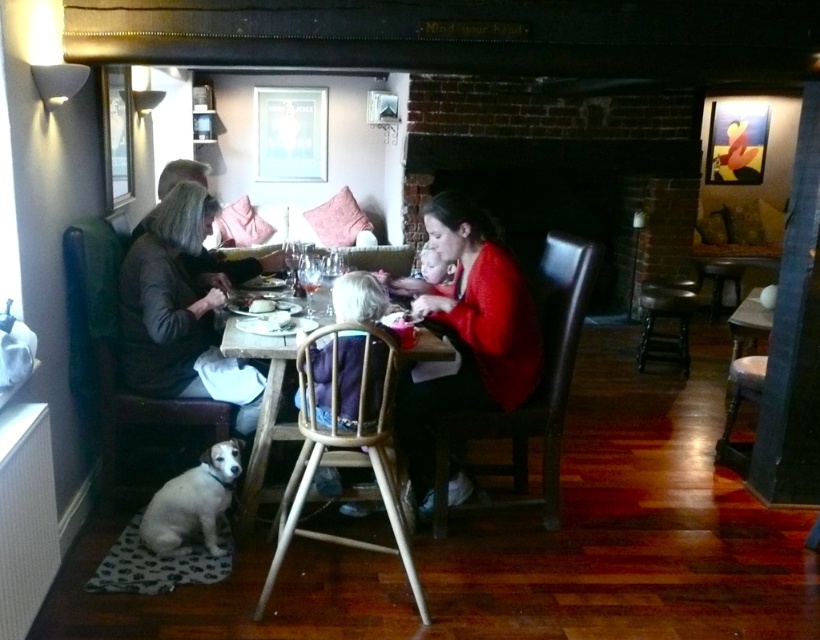
Question: Is dark gray sweater at left above wooden table at center?

Choices:
 (A) no
 (B) yes

Answer: (B)

Question: Is dark gray sweater at left thinner than wooden table at center?

Choices:
 (A) yes
 (B) no

Answer: (B)

Question: Estimate the real-world distances between objects in this image. Which object is closer to the white fur dog at lower left?

Choices:
 (A) wooden stool at lower right
 (B) wooden table at center

Answer: (B)

Question: Which of these objects is positioned farthest from the matte black high chair at center?

Choices:
 (A) white fur dog at lower left
 (B) wooden table at center
 (C) wooden stool at lower right
 (D) metallic stool at center right

Answer: (D)

Question: Can you confirm if red matte sweater at center is positioned to the right of wooden table at center?

Choices:
 (A) no
 (B) yes

Answer: (B)

Question: Which of the following is the closest to the observer?

Choices:
 (A) wooden table at center
 (B) metallic stool at center right

Answer: (A)